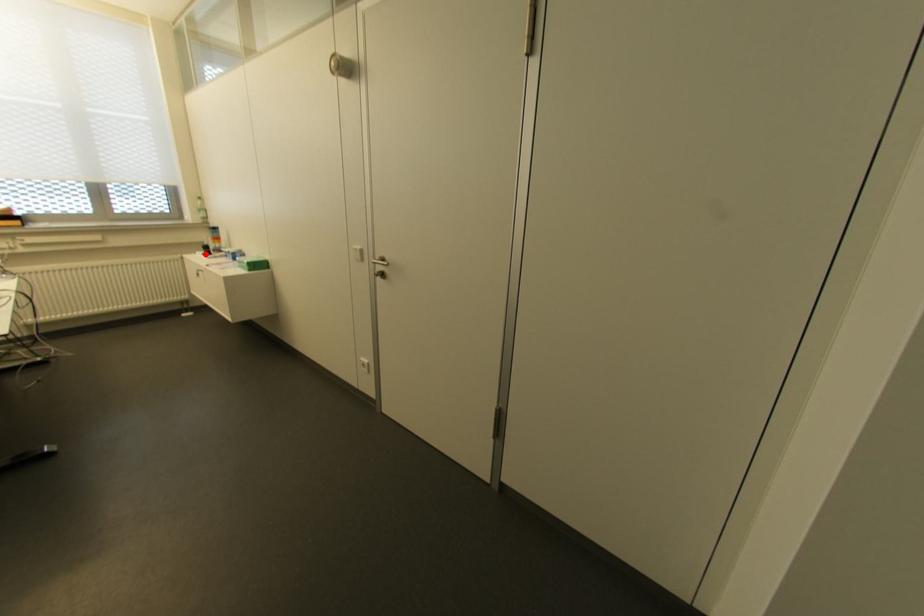
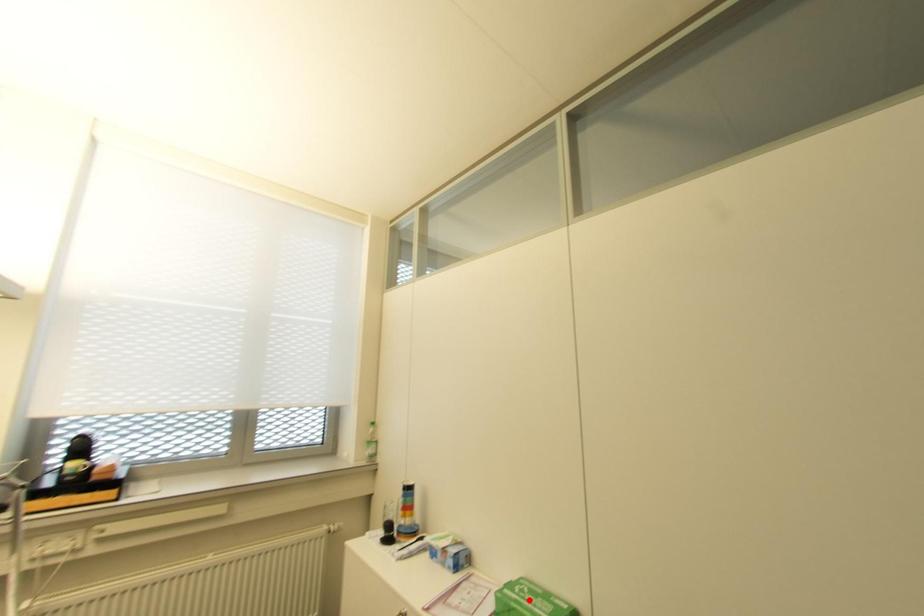
I am providing you with two images of the same scene from different viewpoints. A red point is marked on the first image and another point is marked on the second image. Is the marked point in image1 the same physical position as the marked point in image2?

No